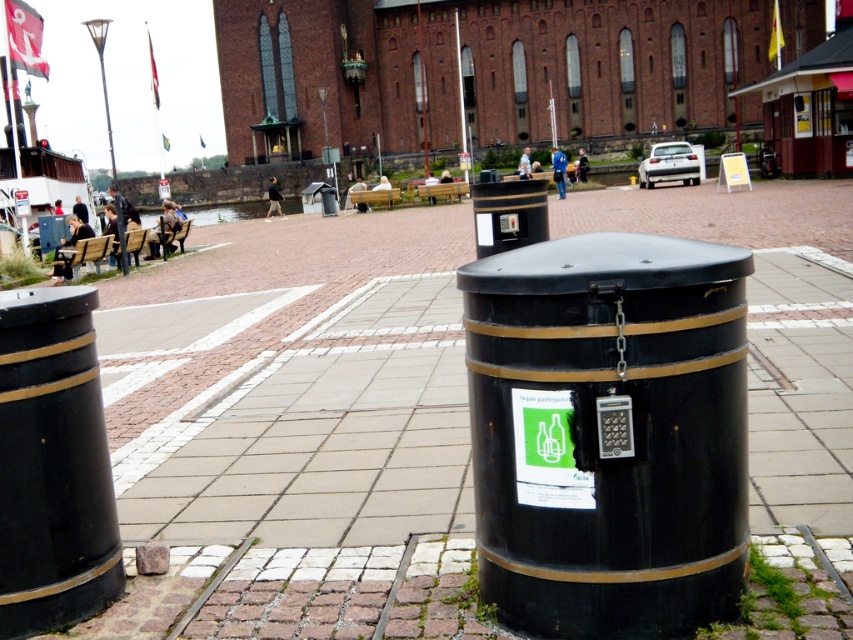
Question: Which object appears closest to the camera in this image?

Choices:
 (A) metallic pole at upper center
 (B) matte black barrel at left

Answer: (B)

Question: Is black metallic trash can at center wider than metallic pole at upper center?

Choices:
 (A) yes
 (B) no

Answer: (A)

Question: Based on their relative distances, which object is farther from the matte black barrel at left?

Choices:
 (A) metallic streetlamp at upper left
 (B) metallic pole at upper center
 (C) black metallic trash can at center

Answer: (B)

Question: Is matte black barrel at left below smooth metal pole at center?

Choices:
 (A) yes
 (B) no

Answer: (A)

Question: Which point is closer to the camera?

Choices:
 (A) (744, 509)
 (B) (456, 22)

Answer: (A)

Question: Is metallic streetlamp at upper left behind smooth metal pole at center?

Choices:
 (A) no
 (B) yes

Answer: (A)